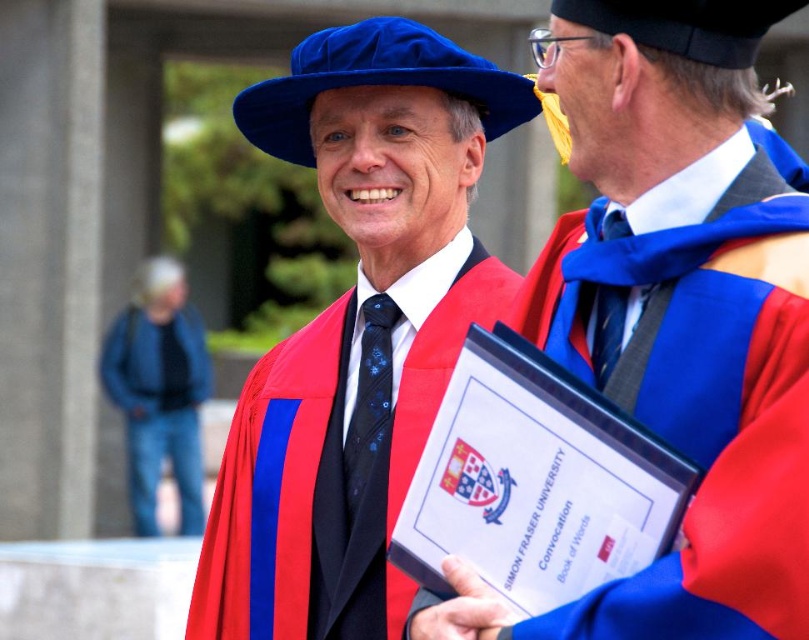
Can you confirm if black satin tie at center is wider than matte blue tie at upper right?

Yes, black satin tie at center is wider than matte blue tie at upper right.

Based on the photo, does black satin tie at center lie behind matte blue tie at upper right?

→ Yes.

Who is more distant from viewer, (375,304) or (595,296)?

The point (375,304) is behind.

The width and height of the screenshot is (809, 640). I want to click on black satin tie at center, so click(x=369, y=404).

Is matte black tie at center further to camera compared to blue denim jeans at lower left?

That is False.

I want to click on matte black tie at center, so click(676, 312).

Who is more forward, (625, 580) or (109, 355)?

Point (625, 580)

At what (x,y) coordinates should I click in order to perform the action: click on matte black tie at center. Please return your answer as a coordinate pair (x, y). The width and height of the screenshot is (809, 640). Looking at the image, I should click on (676, 312).

Which is more to the left, blue denim jeans at lower left or black satin tie at center?

A: From the viewer's perspective, blue denim jeans at lower left appears more on the left side.

Can you confirm if blue denim jeans at lower left is positioned below black satin tie at center?

Correct, blue denim jeans at lower left is located below black satin tie at center.

Is point (185, 508) farther from viewer compared to point (342, 451)?

Yes.

Find the location of `blue denim jeans at lower left`. blue denim jeans at lower left is located at coordinates (159, 390).